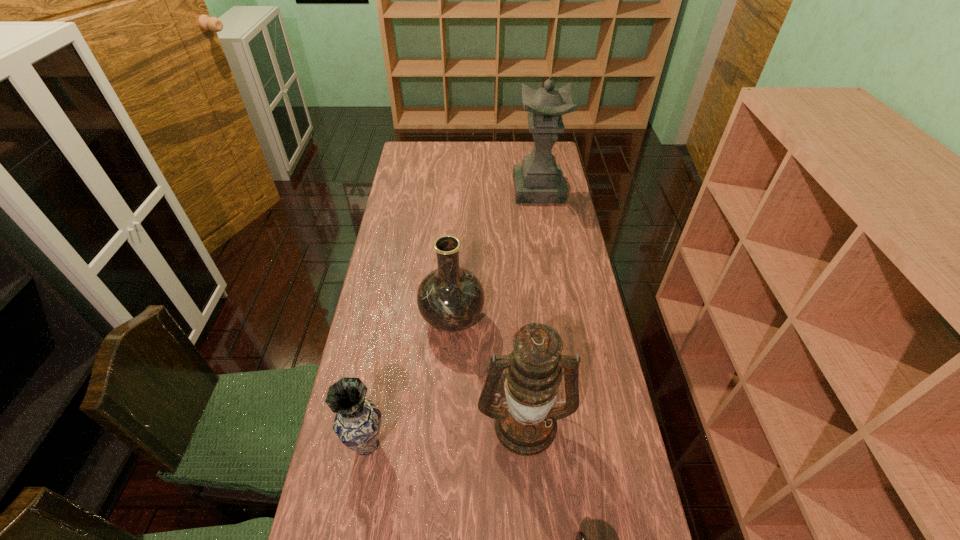
Find the location of a particular element. free space that is in between the leftmost object and the fourth nearest object is located at coordinates (410, 382).

The image size is (960, 540). I want to click on vacant space in between the second shortest object and the taller vase, so click(x=410, y=382).

In order to click on the third closest object to the fourth shortest object in this screenshot , I will do `click(357, 423)`.

What are the coordinates of `object that ranks as the fourth closest to the sculpture` in the screenshot? It's located at pyautogui.click(x=580, y=539).